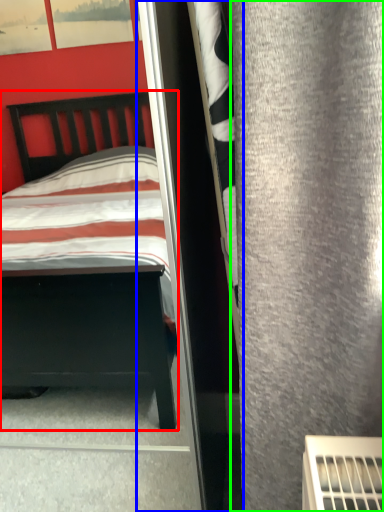
Question: Considering the real-world distances, which object is farthest from bed (highlighted by a red box)? screen door (highlighted by a blue box) or curtain (highlighted by a green box)?

Choices:
 (A) screen door
 (B) curtain

Answer: (B)